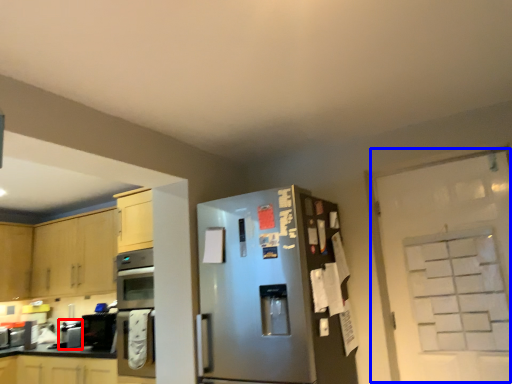
Question: Which point is closer to the camera, appliance (highlighted by a red box) or door (highlighted by a blue box)?

Choices:
 (A) appliance
 (B) door

Answer: (B)